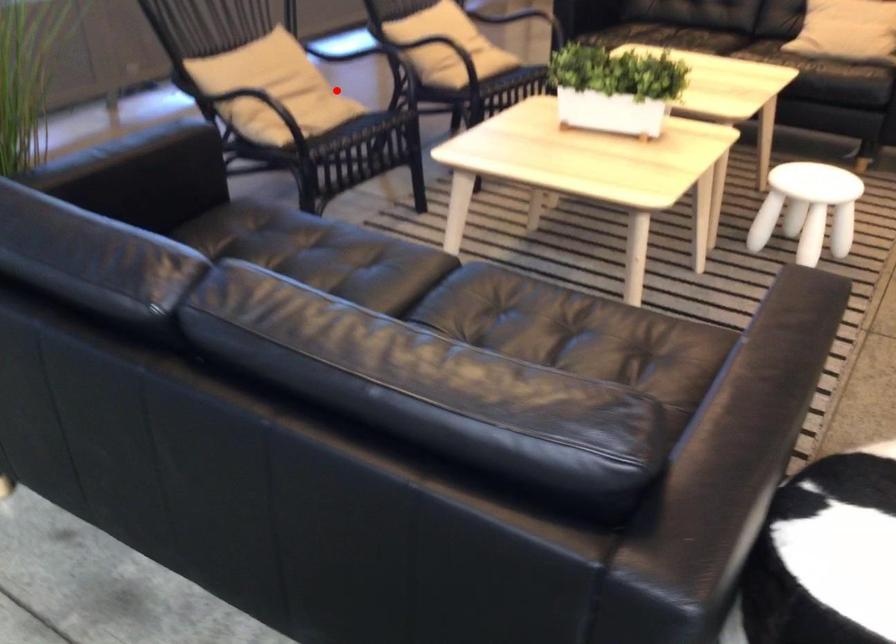
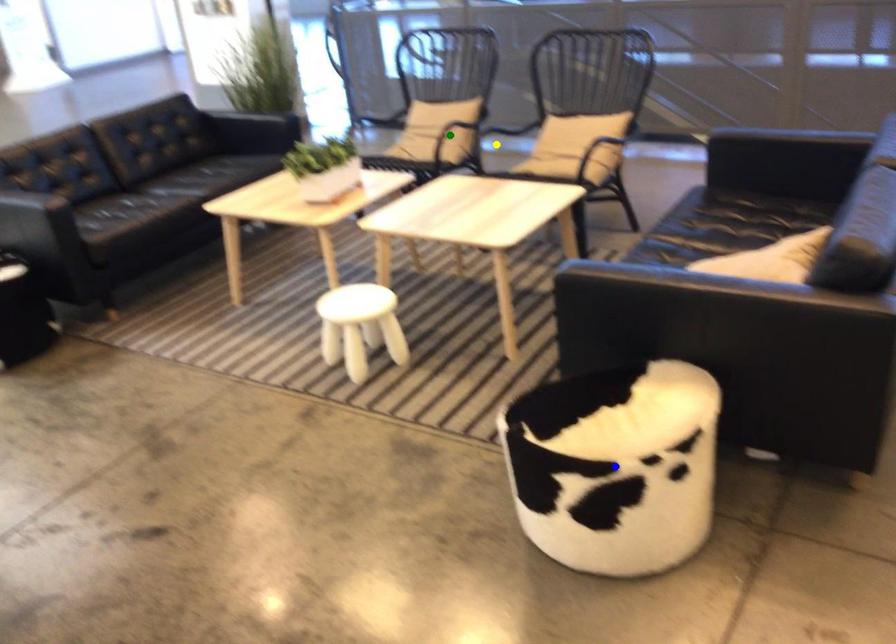
Question: I am providing you with two images of the same scene from different viewpoints. A red point is marked on the first image. You are given multiple points on the second image. Which point in image 2 is actually the same real-world point as the red point in image 1?

Choices:
 (A) yellow point
 (B) green point
 (C) blue point

Answer: (B)